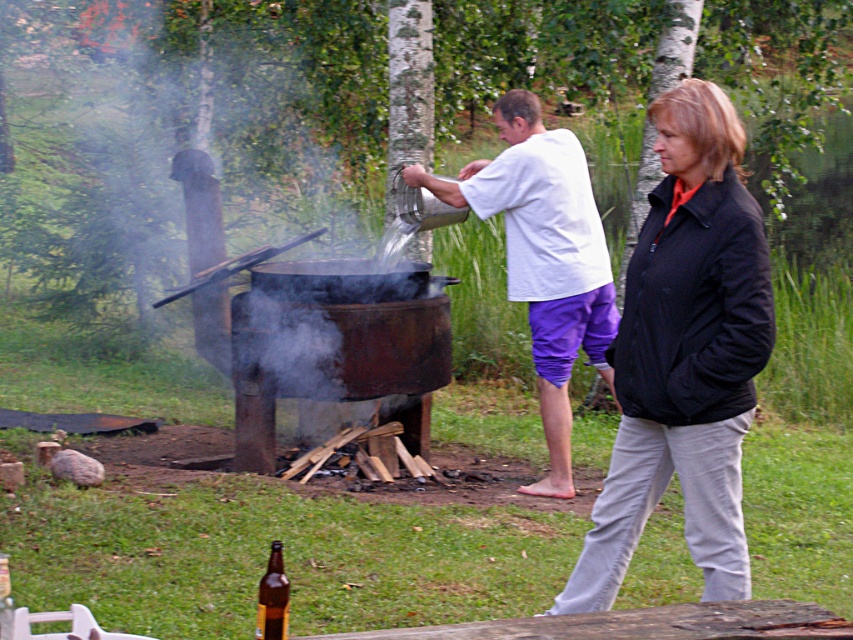
Is black jacket at center shorter than white matte shirt at center?

Indeed, black jacket at center has a lesser height compared to white matte shirt at center.

Does black jacket at center have a greater height compared to white matte shirt at center?

No.

Is point (728, 588) positioned before point (548, 344)?

Yes, it is.

The width and height of the screenshot is (853, 640). What are the coordinates of `black jacket at center` in the screenshot? It's located at (683, 355).

Consider the image. Is white matte shirt at center to the left of brown glass bottle at lower left from the viewer's perspective?

No, white matte shirt at center is not to the left of brown glass bottle at lower left.

Which is in front, point (547, 364) or point (282, 579)?

Point (282, 579)

Locate an element on the screen. The width and height of the screenshot is (853, 640). white matte shirt at center is located at coordinates (543, 257).

Is black jacket at center thinner than brown glass bottle at lower left?

Incorrect, black jacket at center's width is not less than brown glass bottle at lower left's.

Does black jacket at center have a greater width compared to brown glass bottle at lower left?

Yes.

Between point (756, 333) and point (283, 616), which one is positioned behind?

Point (756, 333)

Where is `black jacket at center`? This screenshot has height=640, width=853. black jacket at center is located at coordinates (683, 355).